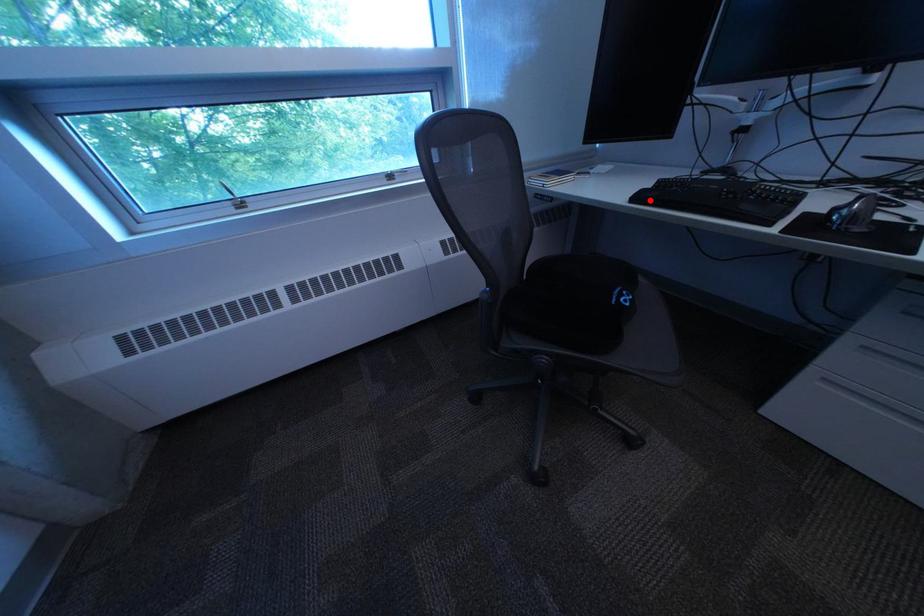
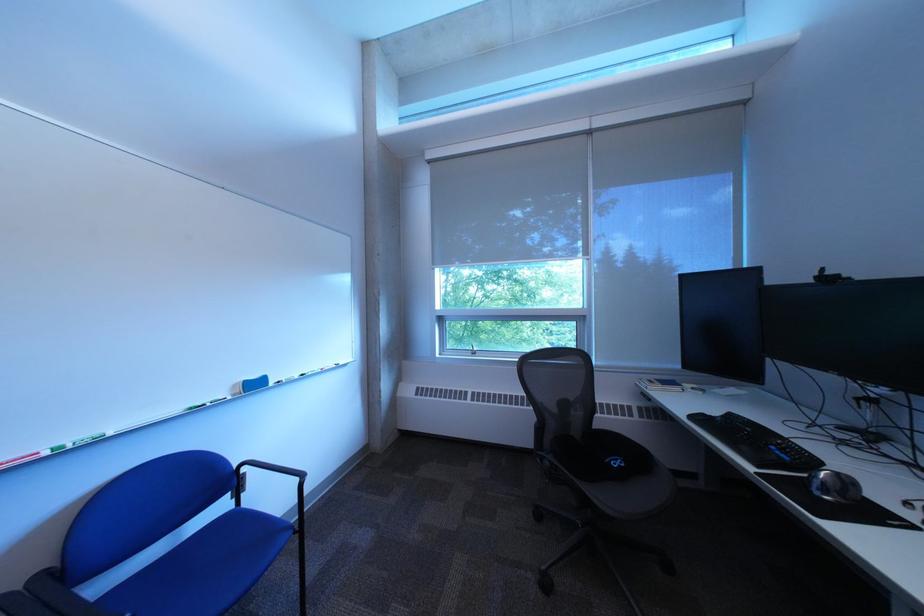
Locate, in the second image, the point that corresponds to the highlighted location in the first image.

(708, 419)